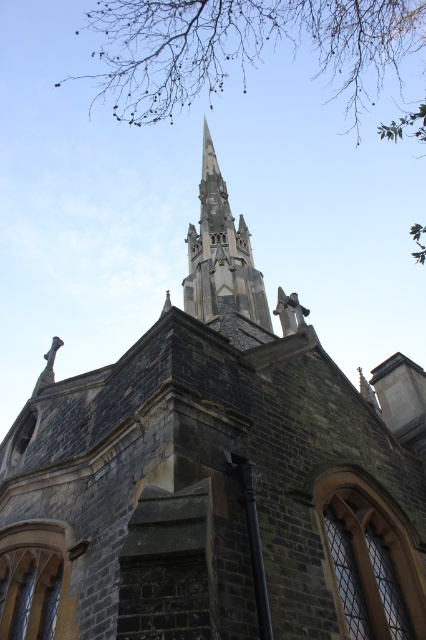
Question: Which object appears farthest from the camera in this image?

Choices:
 (A) brown leafy branches at upper center
 (B) smooth gray stone spire at upper center

Answer: (A)

Question: Can you confirm if brown leafy branches at upper center is thinner than smooth gray stone spire at upper center?

Choices:
 (A) no
 (B) yes

Answer: (A)

Question: Is brown leafy branches at upper center bigger than smooth gray stone spire at upper center?

Choices:
 (A) yes
 (B) no

Answer: (A)

Question: Which point is farther from the camera taking this photo?

Choices:
 (A) (121, 99)
 (B) (210, 161)

Answer: (A)

Question: Can you confirm if brown leafy branches at upper center is positioned below smooth gray stone spire at upper center?

Choices:
 (A) no
 (B) yes

Answer: (A)